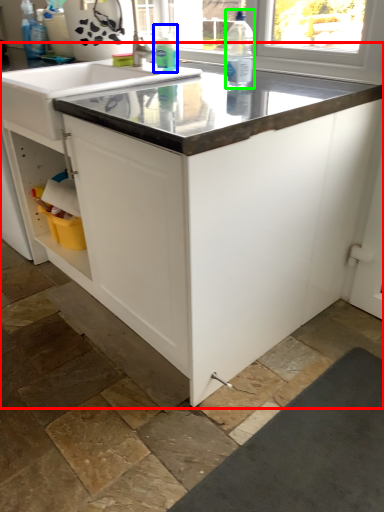
Question: Estimate the real-world distances between objects in this image. Which object is closer to countertop (highlighted by a red box), cleaning product (highlighted by a blue box) or bottle (highlighted by a green box)?

Choices:
 (A) cleaning product
 (B) bottle

Answer: (B)